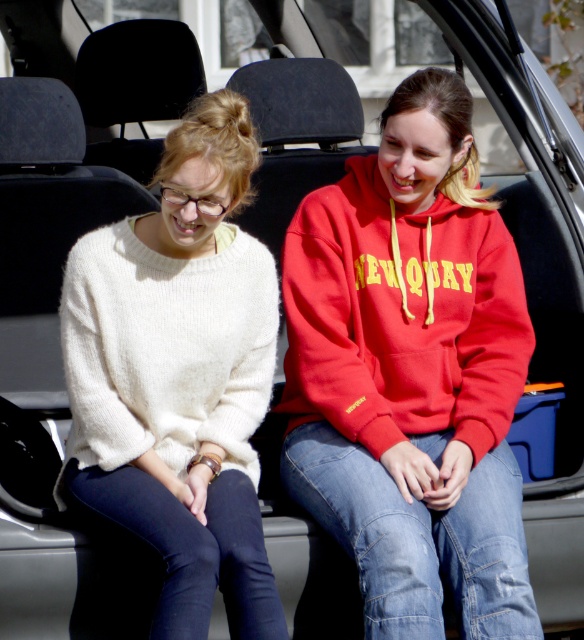
Which of these two, matte red hoodie at center or white fuzzy sweater at left, stands shorter?

white fuzzy sweater at left

Does matte red hoodie at center come behind white fuzzy sweater at left?

Yes, it is.

Where is `matte red hoodie at center`? The image size is (584, 640). matte red hoodie at center is located at coordinates (411, 372).

This screenshot has width=584, height=640. Find the location of `matte red hoodie at center`. matte red hoodie at center is located at coordinates (411, 372).